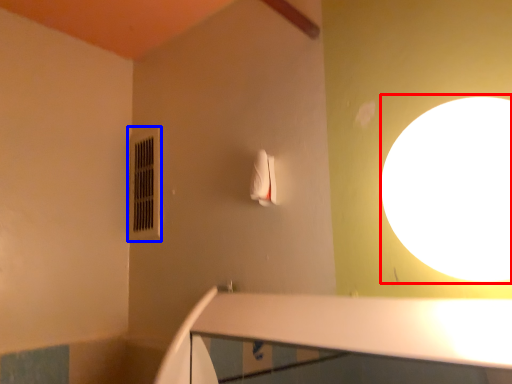
Question: Which point is closer to the camera, light (highlighted by a red box) or air conditioner (highlighted by a blue box)?

Choices:
 (A) light
 (B) air conditioner

Answer: (A)